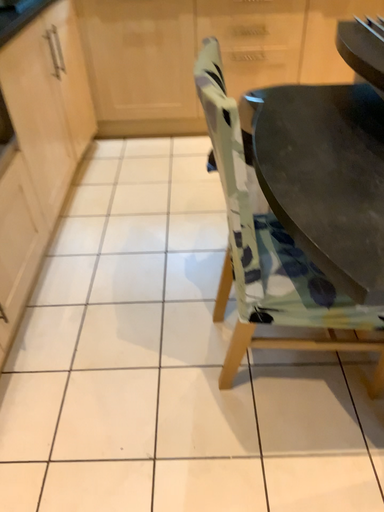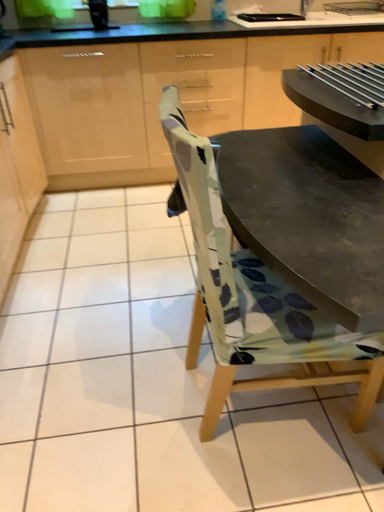
Question: Which way did the camera rotate in the video?

Choices:
 (A) rotated upward
 (B) rotated downward

Answer: (A)